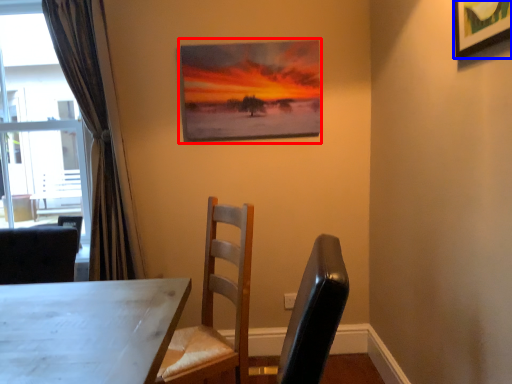
Question: Among these objects, which one is nearest to the camera, picture frame (highlighted by a red box) or picture frame (highlighted by a blue box)?

Choices:
 (A) picture frame
 (B) picture frame

Answer: (B)